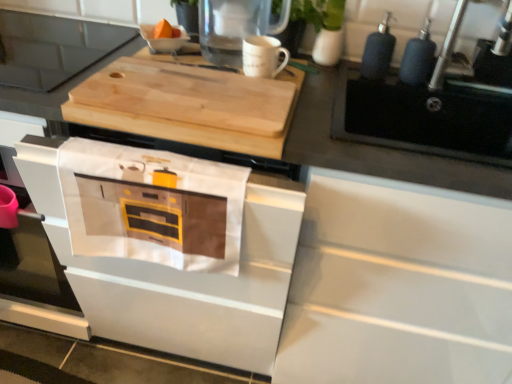
What do you see at coordinates (152, 206) in the screenshot? The width and height of the screenshot is (512, 384). I see `white cotton towel at lower center` at bounding box center [152, 206].

You are a GUI agent. You are given a task and a screenshot of the screen. Output one action in this format:
    pyautogui.click(x=<x>, y=<y>)
    Task: Click on the metallic silver faucet at upper right
    
    Given the screenshot: What is the action you would take?
    pyautogui.click(x=447, y=47)

Where is `natural wood cutting board at upper center`? The width and height of the screenshot is (512, 384). natural wood cutting board at upper center is located at coordinates (188, 105).

What do you see at coordinates (234, 27) in the screenshot? Image resolution: width=512 pixels, height=384 pixels. I see `clear glass pitcher at upper center` at bounding box center [234, 27].

Describe the element at coordinates (168, 250) in the screenshot. I see `white matte oven at center` at that location.

I want to click on white cotton towel at lower center, so click(152, 206).

Is white matte oven at center bigger than natural wood cutting board at upper center?

Indeed, white matte oven at center has a larger size compared to natural wood cutting board at upper center.

Is natural wood cutting board at upper center located within white matte oven at center?

No, white matte oven at center does not contain natural wood cutting board at upper center.

From the image's perspective, is white matte oven at center above or below natural wood cutting board at upper center?

white matte oven at center is below natural wood cutting board at upper center.

Relative to natural wood cutting board at upper center, is white matte oven at center in front or behind?

Visually, white matte oven at center is located in front of natural wood cutting board at upper center.

Looking at this image, can you confirm if wooden cutting board at upper center is thinner than metallic silver faucet at upper right?

No.

Looking at this image, between wooden cutting board at upper center and metallic silver faucet at upper right, which one has smaller size?

metallic silver faucet at upper right is smaller.

Considering the points (81, 38) and (506, 22), which point is behind, point (81, 38) or point (506, 22)?

The point (81, 38) is farther.

From a real-world perspective, is wooden cutting board at upper center on white cotton towel at lower center?

Indeed, from a real-world perspective, wooden cutting board at upper center stands above white cotton towel at lower center.

Considering the relative sizes of wooden cutting board at upper center and white cotton towel at lower center in the image provided, is wooden cutting board at upper center bigger than white cotton towel at lower center?

Yes.

From the image's perspective, is wooden cutting board at upper center located above or below white cotton towel at lower center?

From the image's perspective, wooden cutting board at upper center appears above white cotton towel at lower center.

Is wooden cutting board at upper center not close to white cotton towel at lower center?

No, there isn't a large distance between wooden cutting board at upper center and white cotton towel at lower center.

Considering the sizes of objects white cotton towel at lower center and wooden cutting board at upper center in the image provided, who is wider, white cotton towel at lower center or wooden cutting board at upper center?

With larger width is wooden cutting board at upper center.

Which is nearer, (162,253) or (58,21)?

Point (162,253) appears to be closer to the viewer than point (58,21).

Is white cotton towel at lower center far away from wooden cutting board at upper center?

No, white cotton towel at lower center is not far away from wooden cutting board at upper center.

This screenshot has width=512, height=384. I want to click on cloth on the right of wooden cutting board at upper center, so click(x=152, y=206).

Is metallic silver faucet at upper right further to camera compared to wooden cutting board at upper center?

No, it is not.

Is metallic silver faucet at upper right surrounding wooden cutting board at upper center?

That's incorrect, wooden cutting board at upper center is not inside metallic silver faucet at upper right.

In terms of width, does metallic silver faucet at upper right look wider or thinner when compared to wooden cutting board at upper center?

Clearly, metallic silver faucet at upper right has less width compared to wooden cutting board at upper center.

Can we say white cotton towel at lower center lies outside natural wood cutting board at upper center?

white cotton towel at lower center lies outside natural wood cutting board at upper center's area.

Locate an element on the screen. This screenshot has height=384, width=512. cloth below the natural wood cutting board at upper center (from a real-world perspective) is located at coordinates (152, 206).

Are white cotton towel at lower center and natural wood cutting board at upper center beside each other?

white cotton towel at lower center and natural wood cutting board at upper center are not in contact.

Is natural wood cutting board at upper center at the back of white cotton towel at lower center?

That's right, white cotton towel at lower center is facing away from natural wood cutting board at upper center.

In terms of size, does metallic silver faucet at upper right appear bigger or smaller than white matte oven at center?

Considering their sizes, metallic silver faucet at upper right takes up less space than white matte oven at center.

Which object is positioned more to the left, metallic silver faucet at upper right or white matte oven at center?

From the viewer's perspective, white matte oven at center appears more on the left side.

In the scene shown: Is metallic silver faucet at upper right inside or outside of white matte oven at center?

metallic silver faucet at upper right is not enclosed by white matte oven at center.

Looking at their sizes, would you say metallic silver faucet at upper right is wider or thinner than white matte oven at center?

metallic silver faucet at upper right is thinner than white matte oven at center.

In order to click on cutting board above the white matte oven at center (from a real-world perspective) in this screenshot , I will do `click(188, 105)`.

Where is `home appliance behind the metallic silver faucet at upper right`? Image resolution: width=512 pixels, height=384 pixels. home appliance behind the metallic silver faucet at upper right is located at coordinates (53, 48).

Based on the photo, when comparing their distances from clear glass pitcher at upper center, does white cotton towel at lower center or white matte oven at center seem further?

white matte oven at center.

Looking at the image, which one is located further to metallic silver faucet at upper right, clear glass pitcher at upper center or natural wood cutting board at upper center?

natural wood cutting board at upper center.

Based on their spatial positions, is clear glass pitcher at upper center or white matte oven at center further from wooden cutting board at upper center?

Among the two, white matte oven at center is located further to wooden cutting board at upper center.

From the image, which object appears to be farther from metallic silver faucet at upper right, white matte oven at center or wooden cutting board at upper center?

wooden cutting board at upper center lies further to metallic silver faucet at upper right than the other object.

From the image, which object appears to be nearer to white matte oven at center, white cotton towel at lower center or clear glass pitcher at upper center?

white cotton towel at lower center lies closer to white matte oven at center than the other object.

Based on their spatial positions, is white matte oven at center or clear glass pitcher at upper center further from wooden cutting board at upper center?

The object further to wooden cutting board at upper center is white matte oven at center.

Looking at the image, which one is located closer to white matte oven at center, metallic silver faucet at upper right or wooden cutting board at upper center?

Among the two, wooden cutting board at upper center is located nearer to white matte oven at center.

From the image, which object appears to be nearer to natural wood cutting board at upper center, clear glass pitcher at upper center or white cotton towel at lower center?

white cotton towel at lower center is positioned closer to the anchor natural wood cutting board at upper center.

Locate an element on the screen. This screenshot has height=384, width=512. cloth between wooden cutting board at upper center and natural wood cutting board at upper center is located at coordinates (152, 206).

The image size is (512, 384). What are the coordinates of `oven between white cotton towel at lower center and metallic silver faucet at upper right` in the screenshot? It's located at (168, 250).

Locate an element on the screen. The height and width of the screenshot is (384, 512). cutting board that lies between clear glass pitcher at upper center and white cotton towel at lower center from top to bottom is located at coordinates (188, 105).

Where is `kitchen appliance situated between white cotton towel at lower center and metallic silver faucet at upper right from left to right`? The height and width of the screenshot is (384, 512). kitchen appliance situated between white cotton towel at lower center and metallic silver faucet at upper right from left to right is located at coordinates (234, 27).